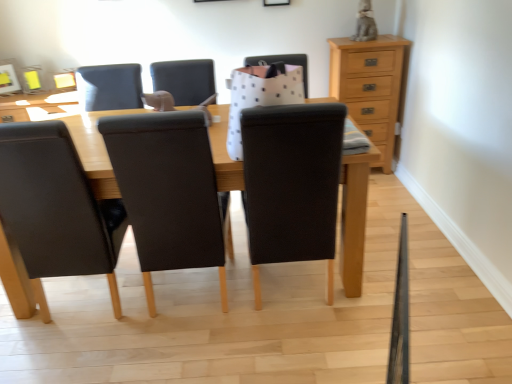
Question: Could you tell me if leather at left, which is the 3th chair in right-to-left order, is facing black fabric chair at center, positioned as the first chair in right-to-left order?

Choices:
 (A) yes
 (B) no

Answer: (B)

Question: Can you confirm if leather at left, the 1th chair from the left, is positioned to the right of black fabric chair at center, which ranks as the third chair in left-to-right order?

Choices:
 (A) yes
 (B) no

Answer: (B)

Question: Is leather at left, the 1th chair from the left, touching black fabric chair at center, positioned as the first chair in right-to-left order?

Choices:
 (A) yes
 (B) no

Answer: (B)

Question: From the image's perspective, does leather at left, the 1th chair from the left, appear lower than black fabric chair at center, positioned as the first chair in right-to-left order?

Choices:
 (A) yes
 (B) no

Answer: (A)

Question: Is leather at left, the 1th chair from the left, to the left of black fabric chair at center, positioned as the first chair in right-to-left order, from the viewer's perspective?

Choices:
 (A) no
 (B) yes

Answer: (B)

Question: From a real-world perspective, is leather at left, the 1th chair from the left, positioned over black fabric chair at center, positioned as the first chair in right-to-left order, based on gravity?

Choices:
 (A) yes
 (B) no

Answer: (B)

Question: Considering the relative sizes of leather at center, positioned as the 2th chair in right-to-left order, and light brown wood chest of drawers at upper right in the image provided, is leather at center, positioned as the 2th chair in right-to-left order, taller than light brown wood chest of drawers at upper right?

Choices:
 (A) yes
 (B) no

Answer: (A)

Question: Is leather at center, which appears as the second chair when viewed from the left, shorter than light brown wood chest of drawers at upper right?

Choices:
 (A) no
 (B) yes

Answer: (A)

Question: Is leather at center, which appears as the second chair when viewed from the left, to the right of light brown wood chest of drawers at upper right from the viewer's perspective?

Choices:
 (A) no
 (B) yes

Answer: (A)

Question: Does leather at center, positioned as the 2th chair in right-to-left order, have a smaller size compared to light brown wood chest of drawers at upper right?

Choices:
 (A) yes
 (B) no

Answer: (B)

Question: Is leather at center, which appears as the second chair when viewed from the left, wider than light brown wood chest of drawers at upper right?

Choices:
 (A) no
 (B) yes

Answer: (B)

Question: Could you tell me if leather at center, positioned as the 2th chair in right-to-left order, is turned towards light brown wood chest of drawers at upper right?

Choices:
 (A) no
 (B) yes

Answer: (A)

Question: Considering the relative sizes of light brown wood chest of drawers at upper right and black fabric chair at center, which ranks as the third chair in left-to-right order, in the image provided, is light brown wood chest of drawers at upper right shorter than black fabric chair at center, which ranks as the third chair in left-to-right order,?

Choices:
 (A) no
 (B) yes

Answer: (B)